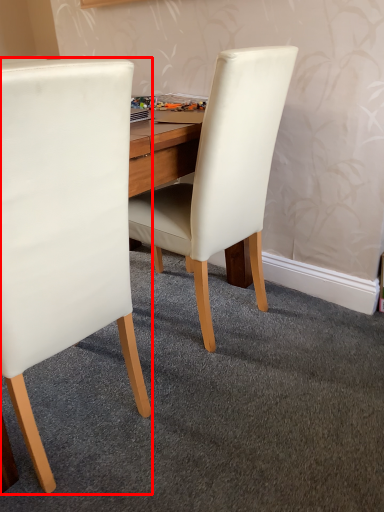
Question: Observing the image, what is the correct spatial positioning of chair (annotated by the red box) in reference to chair?

Choices:
 (A) left
 (B) right

Answer: (A)